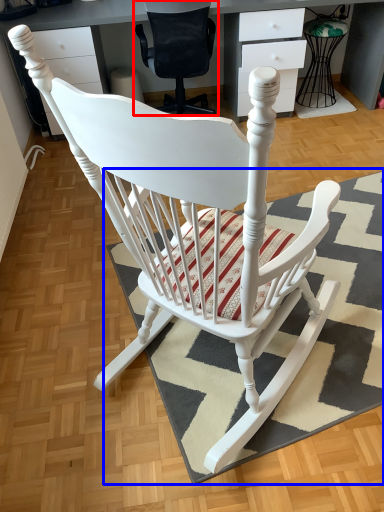
Question: Which object appears farthest to the camera in this image, chair (highlighted by a red box) or doormat (highlighted by a blue box)?

Choices:
 (A) chair
 (B) doormat

Answer: (A)